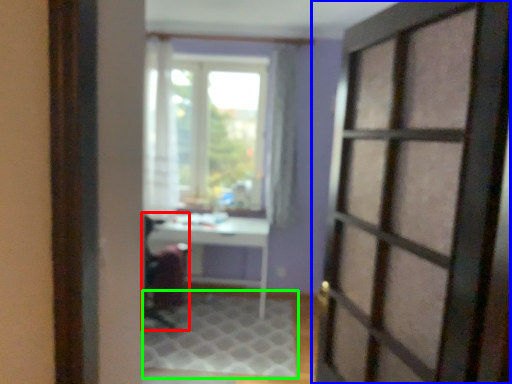
Question: Which is nearer to the armchair (highlighted by a red box)? door (highlighted by a blue box) or doormat (highlighted by a green box).

Choices:
 (A) door
 (B) doormat

Answer: (B)